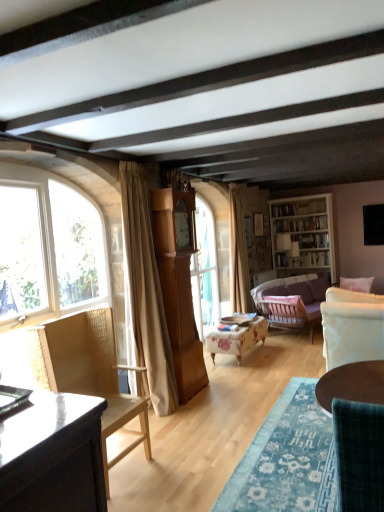
Question: Does point (59, 179) appear closer or farther from the camera than point (127, 264)?

Choices:
 (A) farther
 (B) closer

Answer: (B)

Question: Which is correct: clear glass window at left is inside beige fabric curtain at left, acting as the 1th curtain starting from the front, or outside of it?

Choices:
 (A) inside
 (B) outside

Answer: (B)

Question: Which is nearer to the beige fabric curtain at center, which is the 2th curtain from left to right?

Choices:
 (A) white wooden bookshelf at upper right
 (B) floral fabric ottoman at center, the 1th chair in the back-to-front sequence
 (C) woven wood chair at left, which appears as the third chair when viewed from the right
 (D) velvet purple couch at center right
 (E) beige fabric curtain at left, acting as the 1th curtain starting from the front

Answer: (D)

Question: Which object is positioned closest to the light brown wood grandfather clock at center?

Choices:
 (A) beige fabric curtain at left, placed as the second curtain when sorted from right to left
 (B) floral fabric ottoman at center, the 1th chair in the back-to-front sequence
 (C) woven wood chair at left, which appears as the third chair when viewed from the right
 (D) white wooden bookshelf at upper right
 (E) clear glass window at left

Answer: (A)